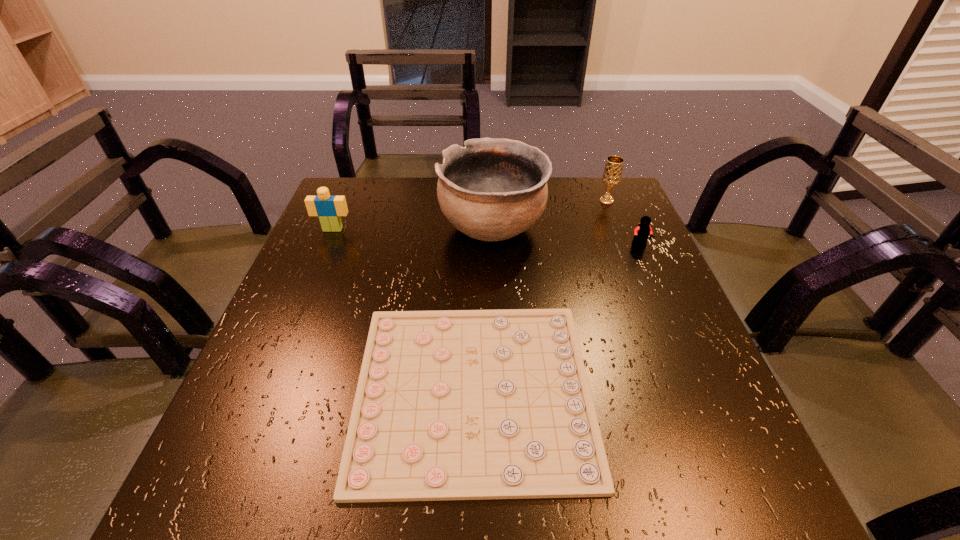
The image size is (960, 540). In order to click on vacant space at the far edge of the desktop in this screenshot , I will do `click(566, 202)`.

In the image, there is a desktop. In order to click on free space at the near edge in this screenshot , I will do [335, 503].

Locate an element on the screen. free spot at the left edge of the desktop is located at coordinates (285, 378).

Where is `free space at the right edge`? This screenshot has height=540, width=960. free space at the right edge is located at coordinates (674, 291).

In the image, there is a desktop. In order to click on vacant area at the near left corner in this screenshot , I will do `click(277, 459)`.

Locate an element on the screen. The height and width of the screenshot is (540, 960). free region at the far right corner of the desktop is located at coordinates (632, 204).

This screenshot has width=960, height=540. Identify the location of vacant area between the leftmost object and the nearest object. (403, 310).

Image resolution: width=960 pixels, height=540 pixels. I want to click on free area in between the chalice and the nearer Lego, so click(623, 223).

The image size is (960, 540). In order to click on vacant space that's between the nearest object and the chalice in this screenshot , I will do `click(540, 295)`.

Where is `free space between the fourth tallest object and the tallest object`? free space between the fourth tallest object and the tallest object is located at coordinates (566, 237).